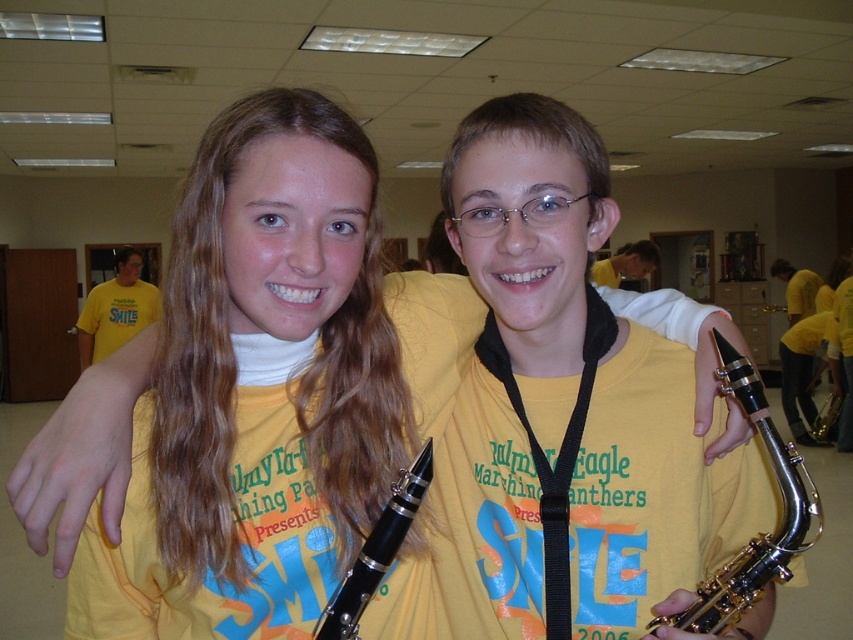
From the picture: Can you confirm if black lacquered hautboy at center is shorter than black plastic clarinet at center?

No, black lacquered hautboy at center is not shorter than black plastic clarinet at center.

Can you confirm if black lacquered hautboy at center is positioned above black plastic clarinet at center?

Indeed, black lacquered hautboy at center is positioned over black plastic clarinet at center.

Image resolution: width=853 pixels, height=640 pixels. I want to click on black lacquered hautboy at center, so click(x=561, y=404).

Who is higher up, black lacquered hautboy at center or gold metallic saxophone at center?

black lacquered hautboy at center

Locate an element on the screen. The image size is (853, 640). black lacquered hautboy at center is located at coordinates (561, 404).

Between point (611, 614) and point (819, 417), which one is positioned behind?

Positioned behind is point (819, 417).

The width and height of the screenshot is (853, 640). Find the location of `black lacquered hautboy at center`. black lacquered hautboy at center is located at coordinates (561, 404).

Who is positioned more to the left, silver metallic saxophone at right or gold metallic saxophone at center?

silver metallic saxophone at right is more to the left.

Consider the image. How far apart are silver metallic saxophone at right and gold metallic saxophone at center?

They are 19.25 feet apart.

Locate an element on the screen. The width and height of the screenshot is (853, 640). silver metallic saxophone at right is located at coordinates (759, 532).